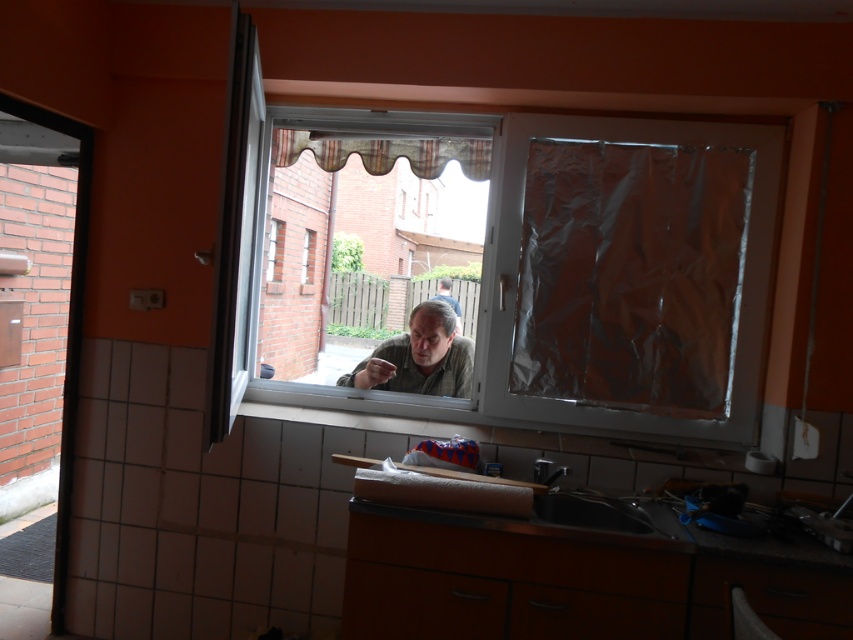
Is transparent plastic window at center to the left of matte brown hair at center from the viewer's perspective?

In fact, transparent plastic window at center is to the right of matte brown hair at center.

Who is shorter, transparent plastic window at center or matte brown hair at center?

With less height is matte brown hair at center.

Locate an element on the screen. transparent plastic window at center is located at coordinates (595, 264).

Who is positioned more to the right, transparent plastic window at center or black matte sink at lower center?

From the viewer's perspective, black matte sink at lower center appears more on the right side.

Is point (331, 156) closer to camera compared to point (560, 506)?

That is False.

What are the coordinates of `transparent plastic window at center` in the screenshot? It's located at (595, 264).

Does black matte sink at lower center have a lesser height compared to matte brown hair at center?

No.

Is black matte sink at lower center bigger than matte brown hair at center?

Indeed, black matte sink at lower center has a larger size compared to matte brown hair at center.

Does point (554, 522) come behind point (445, 282)?

No, (554, 522) is in front of (445, 282).

Identify the location of black matte sink at lower center. coord(589,508).